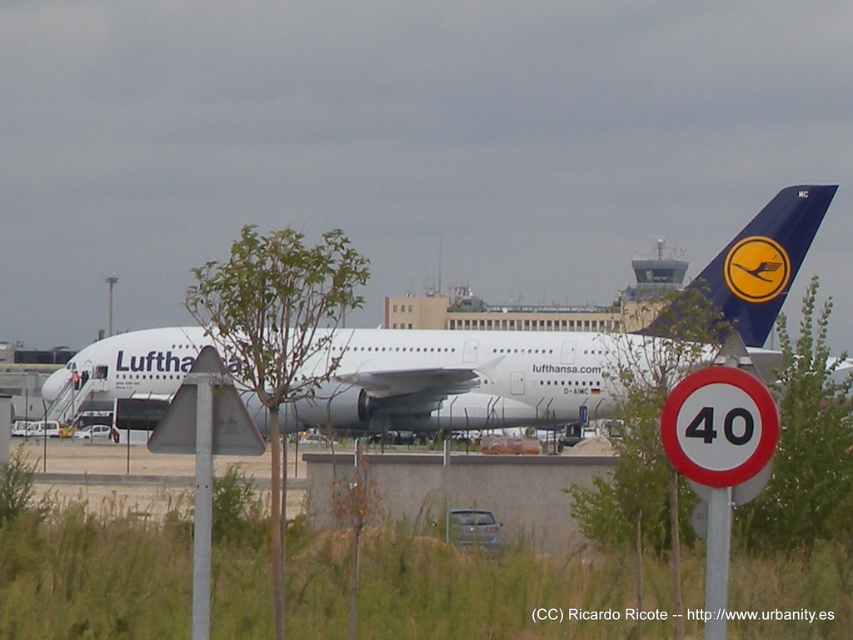
Question: Which object is closer to the camera taking this photo?

Choices:
 (A) white metallic airplane at center
 (B) metallic triangular sign at center-left
 (C) white circular sign with black number at center at right

Answer: (C)

Question: Can you confirm if red plastic speed limit sign at center is bigger than white circular sign with black number at center at right?

Choices:
 (A) no
 (B) yes

Answer: (B)

Question: Which point appears closest to the camera in this image?

Choices:
 (A) (769, 317)
 (B) (195, 499)
 (C) (740, 410)

Answer: (C)

Question: Can you confirm if white metallic airplane at center is smaller than red plastic speed limit sign at center?

Choices:
 (A) yes
 (B) no

Answer: (B)

Question: Which point appears closest to the camera in this image?

Choices:
 (A) (677, 445)
 (B) (202, 440)

Answer: (A)

Question: Does red plastic speed limit sign at center appear over metallic triangular sign at center-left?

Choices:
 (A) yes
 (B) no

Answer: (A)